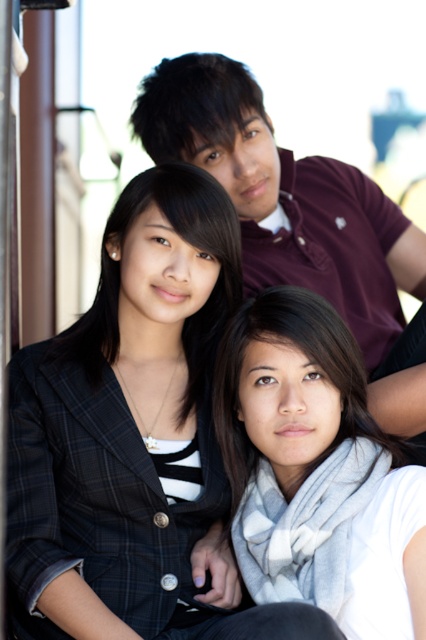
Does plaid blazer at center have a lesser height compared to matte black blazer at center?

In fact, plaid blazer at center may be taller than matte black blazer at center.

Does plaid blazer at center have a smaller size compared to matte black blazer at center?

No, plaid blazer at center is not smaller than matte black blazer at center.

Is point (114, 429) positioned before point (206, 369)?

That is True.

Locate an element on the screen. plaid blazer at center is located at coordinates (132, 435).

Can you confirm if white soft scarf at center is positioned to the right of matte black blazer at center?

Indeed, white soft scarf at center is positioned on the right side of matte black blazer at center.

Which is more to the right, white soft scarf at center or matte black blazer at center?

white soft scarf at center

Between point (322, 304) and point (184, 196), which one is positioned in front?

Point (184, 196) is in front.

You are a GUI agent. You are given a task and a screenshot of the screen. Output one action in this format:
    pyautogui.click(x=<x>, y=<y>)
    Task: Click on the white soft scarf at center
    
    Given the screenshot: What is the action you would take?
    pyautogui.click(x=294, y=444)

Who is positioned more to the left, matte black blazer at center or matte black hair at upper center?

From the viewer's perspective, matte black blazer at center appears more on the left side.

Is matte black blazer at center wider than matte black hair at upper center?

No, matte black blazer at center is not wider than matte black hair at upper center.

Is point (199, 236) closer to camera compared to point (190, 81)?

Yes, point (199, 236) is in front of point (190, 81).

The width and height of the screenshot is (426, 640). I want to click on matte black blazer at center, so click(184, 241).